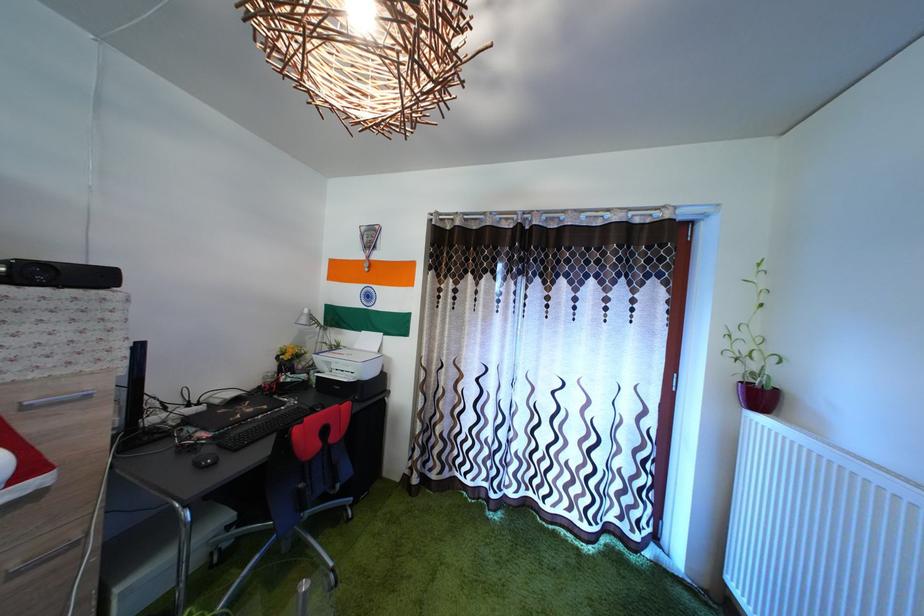
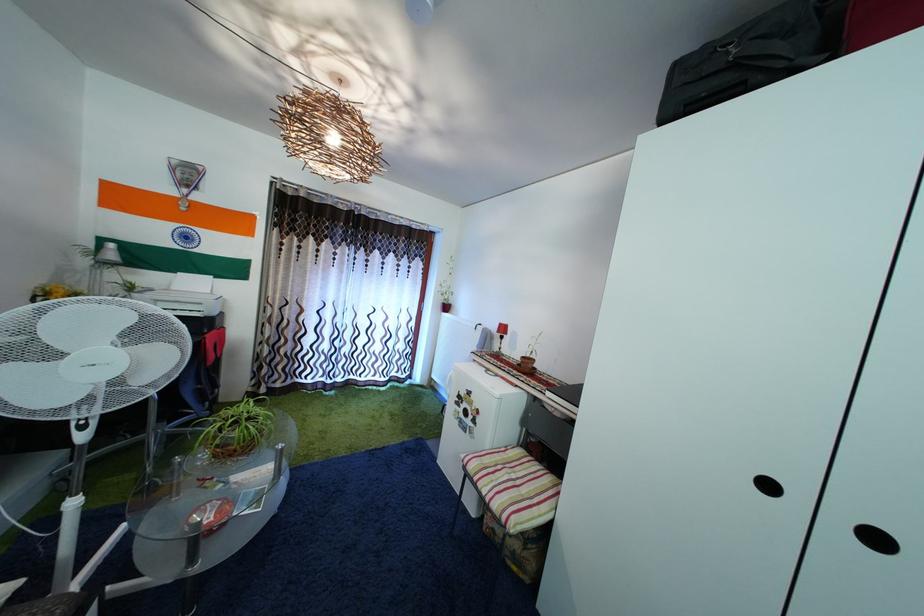
Find the pixel in the second image that matches (x=540, y=501) in the first image.

(359, 384)